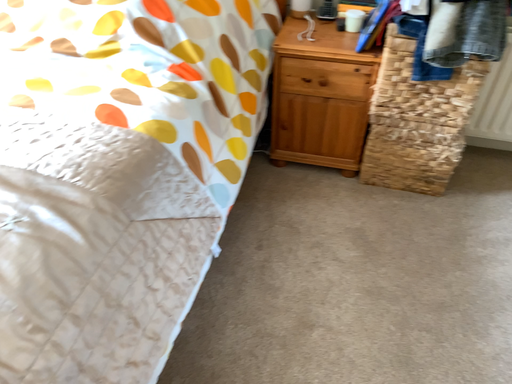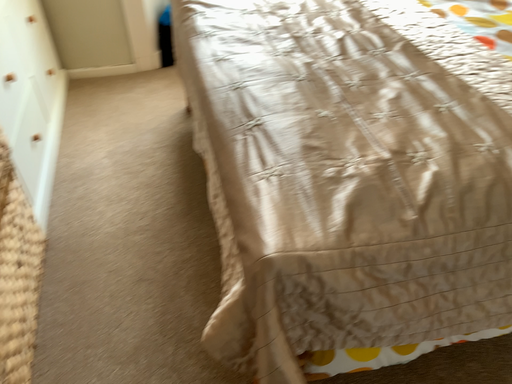
Question: How did the camera likely rotate when shooting the video?

Choices:
 (A) rotated left
 (B) rotated right

Answer: (A)